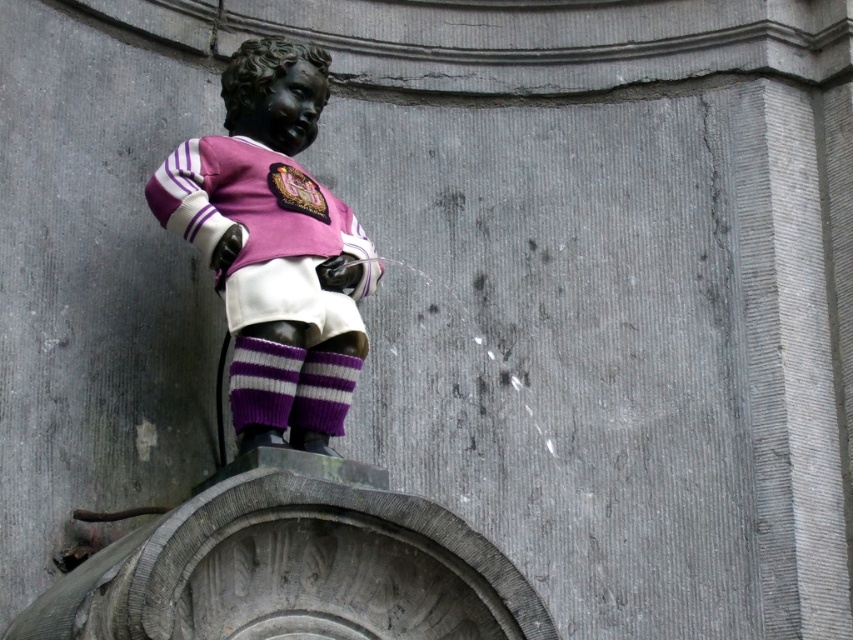
Question: Is matte bronze statue at center to the right of polished bronze statue at center from the viewer's perspective?

Choices:
 (A) no
 (B) yes

Answer: (A)

Question: Is matte bronze statue at center thinner than polished bronze statue at center?

Choices:
 (A) no
 (B) yes

Answer: (A)

Question: Which object appears farthest from the camera in this image?

Choices:
 (A) polished bronze statue at center
 (B) matte bronze statue at center

Answer: (A)

Question: Is matte bronze statue at center above polished bronze statue at center?

Choices:
 (A) no
 (B) yes

Answer: (A)